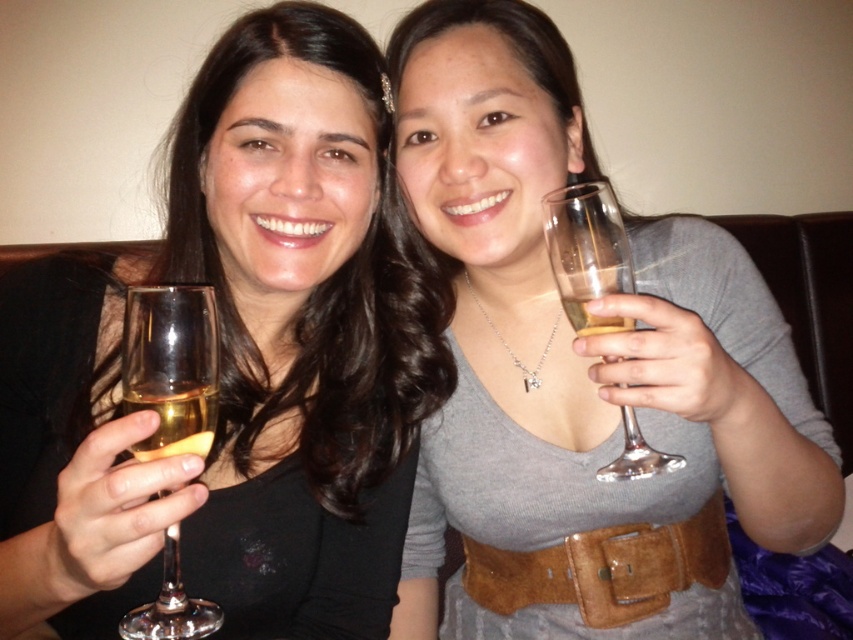
Question: Which point appears closest to the camera in this image?

Choices:
 (A) (215, 401)
 (B) (137, 376)
 (C) (683, 465)
 (D) (633, 216)

Answer: (B)

Question: Does brown suede belt at center have a lesser width compared to clear glass wine glass at right?

Choices:
 (A) yes
 (B) no

Answer: (B)

Question: Does matte glass at center appear on the left side of brown suede belt at center?

Choices:
 (A) no
 (B) yes

Answer: (B)

Question: Can you confirm if brown suede belt at center is positioned above translucent glass at left?

Choices:
 (A) no
 (B) yes

Answer: (A)

Question: Which point appears closest to the camera in this image?

Choices:
 (A) (604, 244)
 (B) (187, 387)
 (C) (636, 586)
 (D) (646, 522)

Answer: (B)

Question: Based on their relative distances, which object is nearer to the matte black wine glass at center?

Choices:
 (A) translucent glass at left
 (B) matte glass at center

Answer: (B)